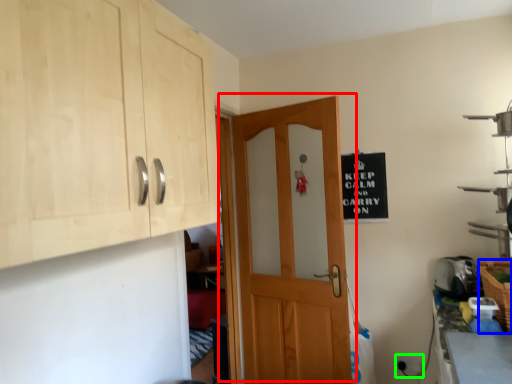
Question: Which object is positioned closest to door (highlighted by a red box)? Select from basket (highlighted by a blue box) and electric outlet (highlighted by a green box).

Choices:
 (A) basket
 (B) electric outlet

Answer: (B)